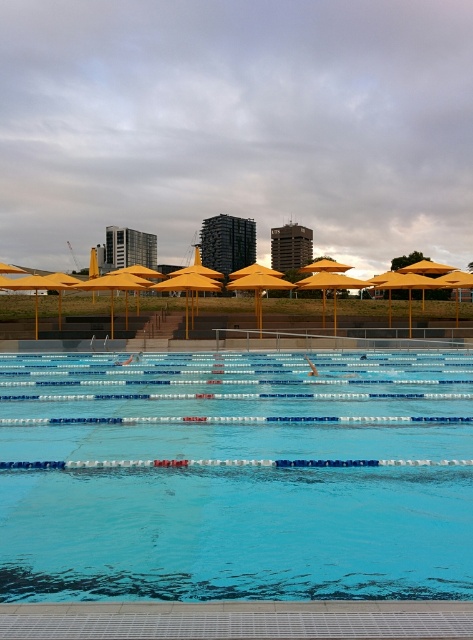
Question: Which object is farther from the camera taking this photo?

Choices:
 (A) yellow matte umbrella at center
 (B) clear blue water at center

Answer: (A)

Question: Does clear blue water at center appear on the right side of yellow matte umbrella at center?

Choices:
 (A) yes
 (B) no

Answer: (A)

Question: Among these objects, which one is nearest to the camera?

Choices:
 (A) clear blue water at center
 (B) yellow matte umbrella at center

Answer: (A)

Question: Does clear blue water at center appear over yellow matte umbrella at center?

Choices:
 (A) no
 (B) yes

Answer: (A)

Question: Can you confirm if clear blue water at center is smaller than yellow matte umbrella at center?

Choices:
 (A) no
 (B) yes

Answer: (B)